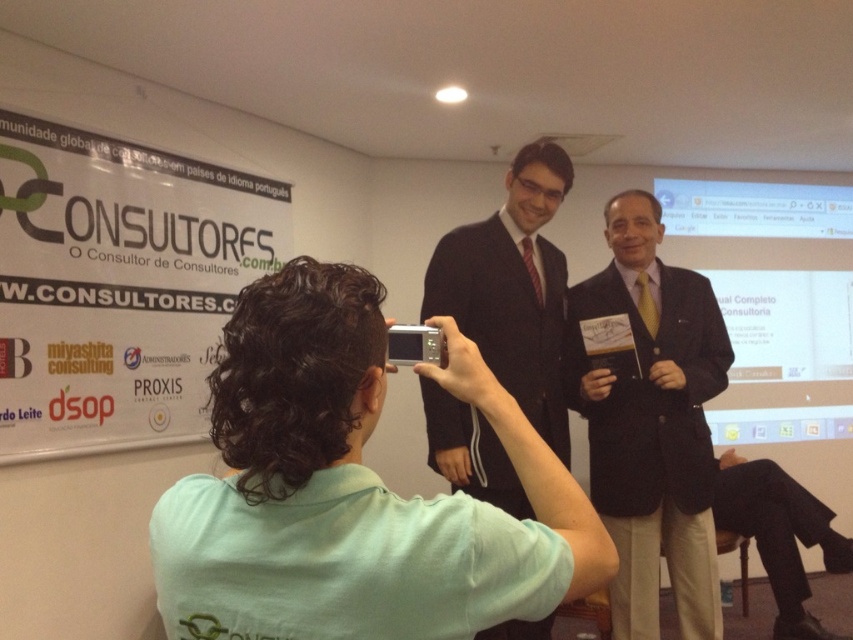
Does green fabric shirt at center have a greater width compared to dark brown suit at center?

Incorrect, green fabric shirt at center's width does not surpass dark brown suit at center's.

Consider the image. Who is taller, green fabric shirt at center or dark brown suit at center?

With more height is dark brown suit at center.

Image resolution: width=853 pixels, height=640 pixels. Identify the location of green fabric shirt at center. (352, 490).

The height and width of the screenshot is (640, 853). What are the coordinates of `green fabric shirt at center` in the screenshot? It's located at (352, 490).

Is green fabric shirt at center wider than white paperboard at upper center?

In fact, green fabric shirt at center might be narrower than white paperboard at upper center.

Is green fabric shirt at center shorter than white paperboard at upper center?

Yes, green fabric shirt at center is shorter than white paperboard at upper center.

Find the location of a particular element. green fabric shirt at center is located at coordinates (352, 490).

Between point (154, 381) and point (518, 308), which one is positioned behind?

The point (154, 381) is more distant.

Measure the distance between point (7, 422) and camera.

Point (7, 422) is 2.57 meters away from camera.

Find the location of a particular element. Image resolution: width=853 pixels, height=640 pixels. white paperboard at upper center is located at coordinates (117, 284).